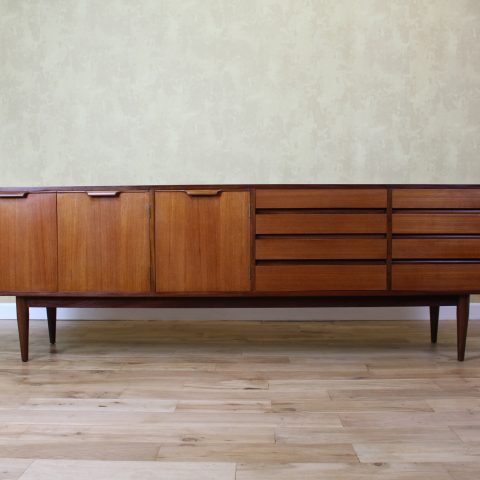
The image size is (480, 480). I want to click on light gray and white textured wall, so click(x=270, y=66).